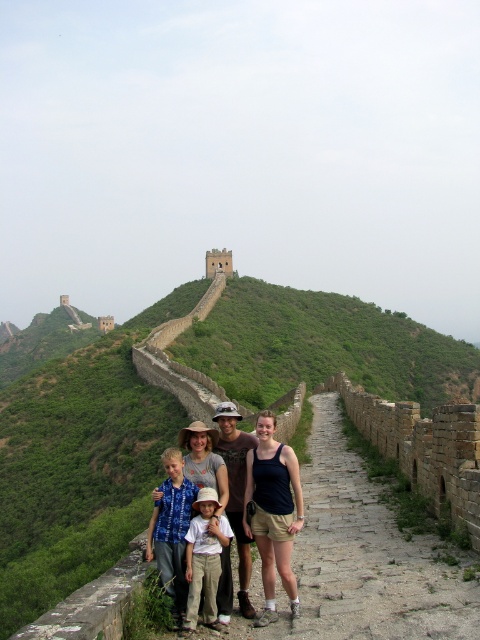
Does matte blue shirt at center have a lesser height compared to dark brown leather boots at center?

In fact, matte blue shirt at center may be taller than dark brown leather boots at center.

Does matte blue shirt at center appear under dark brown leather boots at center?

Actually, matte blue shirt at center is above dark brown leather boots at center.

The height and width of the screenshot is (640, 480). Describe the element at coordinates (237, 488) in the screenshot. I see `matte blue shirt at center` at that location.

This screenshot has height=640, width=480. Find the location of `matte blue shirt at center`. matte blue shirt at center is located at coordinates (237, 488).

Does matte blue shirt at center appear on the right side of blue tie-dye shirt at center?

Correct, you'll find matte blue shirt at center to the right of blue tie-dye shirt at center.

Who is higher up, matte blue shirt at center or blue tie-dye shirt at center?

matte blue shirt at center

The width and height of the screenshot is (480, 640). In order to click on matte blue shirt at center in this screenshot , I will do `click(237, 488)`.

Is matte blue shirt at center smaller than light brown cotton shorts at center?

Actually, matte blue shirt at center might be larger than light brown cotton shorts at center.

Is point (249, 563) less distant than point (204, 566)?

No, (249, 563) is behind (204, 566).

The image size is (480, 640). I want to click on matte blue shirt at center, so click(x=237, y=488).